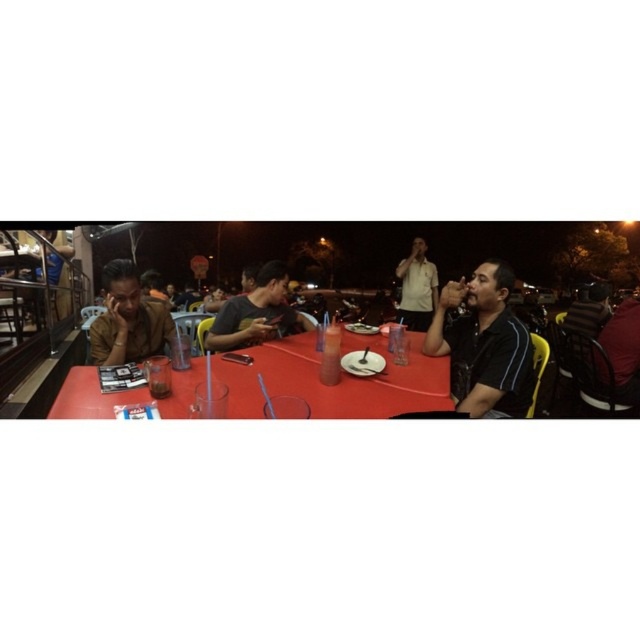
You are a photographer taking a photo of the dark gray fabric shirt at center and the white matte shirt at center. Which shirt should you focus on if you want to capture the smaller one in the frame?

The dark gray fabric shirt at center is smaller than the white matte shirt at center, so you should focus on the dark gray fabric shirt at center to capture the smaller one in the frame.

You are sitting at the red tablecloth table in the lively outdoor dining scene. There are two points marked on the table surface. One is at coordinates point (227, 314) and the other at point (632, 356). If you want to reach the point that is closer to you, which coordinate should you aim for?

The point at coordinates point (227, 314) is in front of point (632, 356), so you should aim for point (227, 314) as it is closer to you.